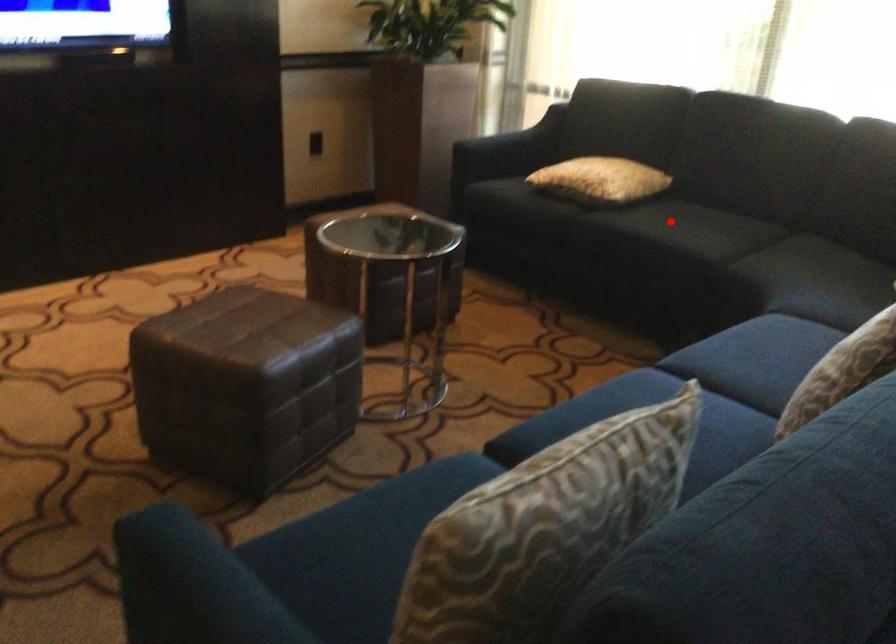
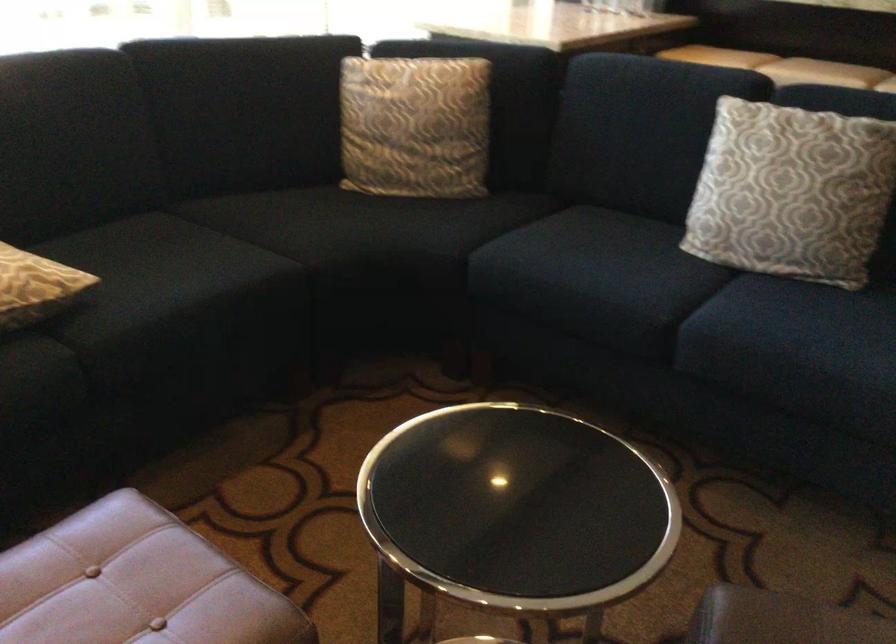
Locate, in the second image, the point that corresponds to the highlighted location in the first image.

(161, 270)